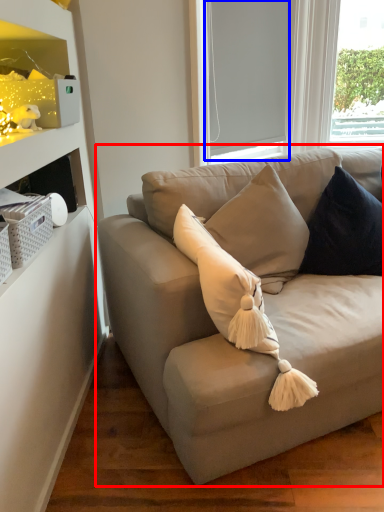
Question: Among these objects, which one is farthest to the camera, studio couch (highlighted by a red box) or window screen (highlighted by a blue box)?

Choices:
 (A) studio couch
 (B) window screen

Answer: (B)